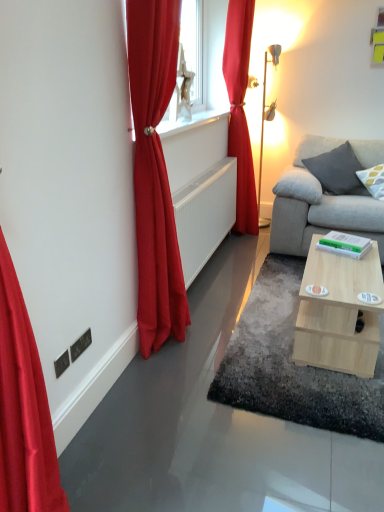
You are a GUI agent. You are given a task and a screenshot of the screen. Output one action in this format:
    pyautogui.click(x=<x>, y=<y>)
    Task: Click on the free spot above light wood/texture coffee table at lower right (from a real-world perspective)
    The height and width of the screenshot is (512, 384).
    Given the screenshot: What is the action you would take?
    pyautogui.click(x=355, y=268)